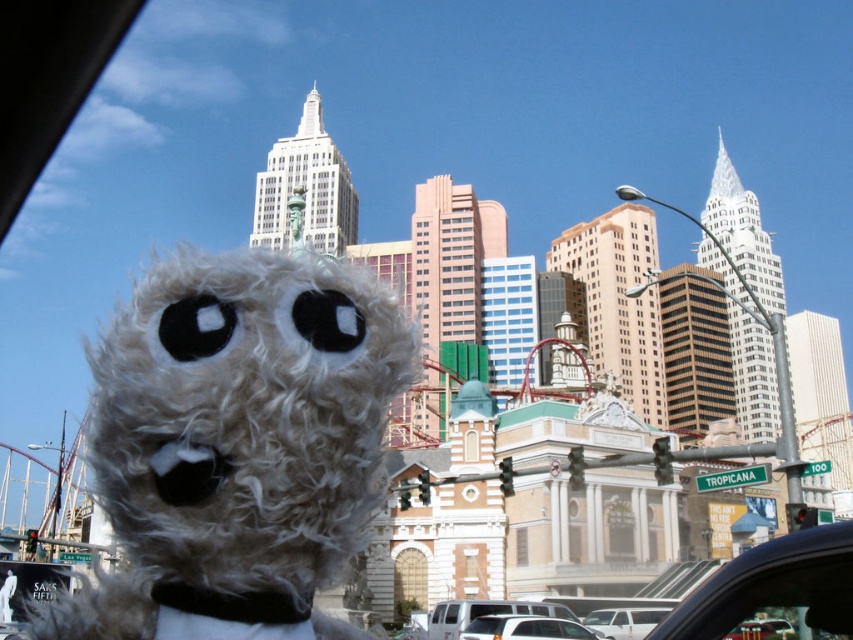
Question: Can you confirm if fluffy white stuffed animal at center is thinner than white matte car at lower center?

Choices:
 (A) no
 (B) yes

Answer: (A)

Question: Can you confirm if fluffy white stuffed animal at center is wider than white matte car at lower center?

Choices:
 (A) no
 (B) yes

Answer: (B)

Question: Which object appears farthest from the camera in this image?

Choices:
 (A) fluffy white stuffed animal at center
 (B) white matte car at lower center

Answer: (B)

Question: Does fluffy white stuffed animal at center have a larger size compared to white matte car at lower center?

Choices:
 (A) yes
 (B) no

Answer: (A)